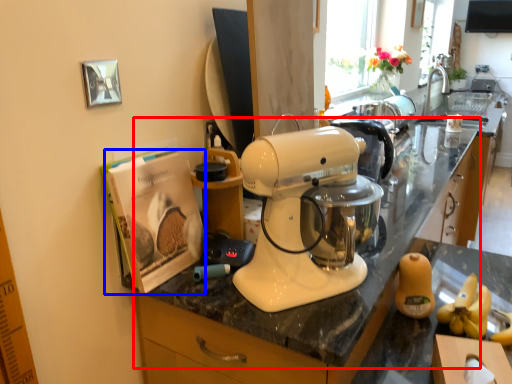
Question: Which object is closer to the camera taking this photo, countertop (highlighted by a red box) or magazine (highlighted by a blue box)?

Choices:
 (A) countertop
 (B) magazine

Answer: (A)